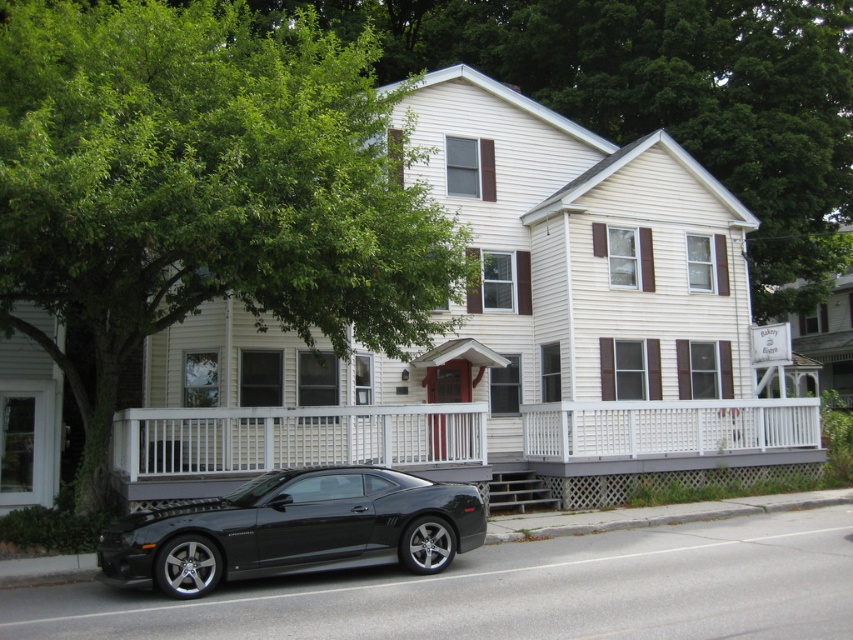
Question: Based on their relative distances, which object is farther from the black glossy sedan at lower left?

Choices:
 (A) green leafy tree at upper left
 (B) white wooden porch at lower center

Answer: (A)

Question: Does green leafy tree at upper left lie in front of white wooden porch at lower center?

Choices:
 (A) yes
 (B) no

Answer: (A)

Question: Does white wooden porch at lower center have a greater width compared to black glossy sedan at lower left?

Choices:
 (A) no
 (B) yes

Answer: (B)

Question: Does white wooden porch at lower center come behind black glossy sedan at lower left?

Choices:
 (A) no
 (B) yes

Answer: (B)

Question: Which object is farther from the camera taking this photo?

Choices:
 (A) green leafy tree at upper left
 (B) white wooden porch at lower center
 (C) black glossy sedan at lower left

Answer: (B)

Question: Which object appears farthest from the camera in this image?

Choices:
 (A) black glossy sedan at lower left
 (B) green leafy tree at upper left
 (C) white wooden porch at lower center

Answer: (C)